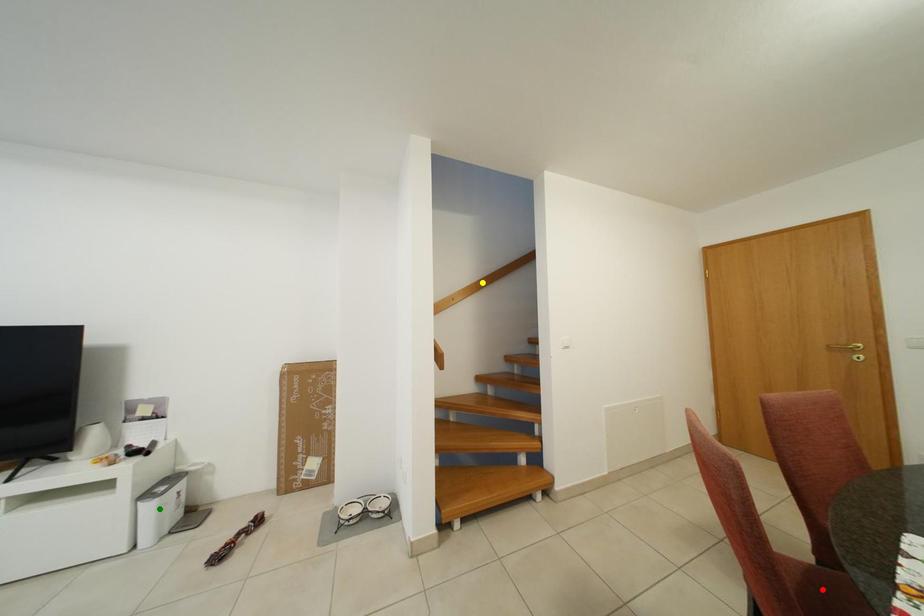
Order these from farthest to nearest:
red point
green point
yellow point

yellow point → green point → red point